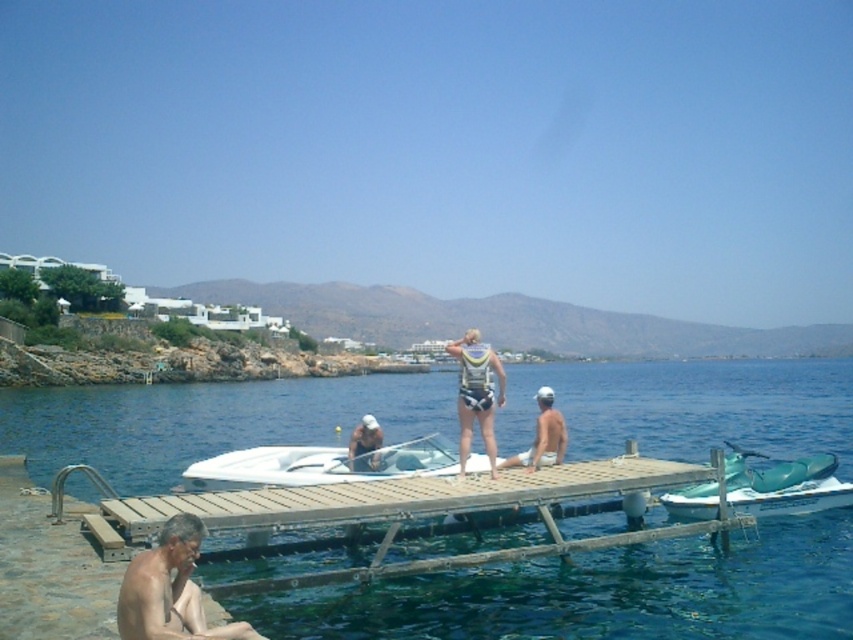
Describe the element at coordinates (318, 465) in the screenshot. Image resolution: width=853 pixels, height=640 pixels. I see `white glossy boat at center` at that location.

Consider the image. Who is positioned more to the left, white glossy boat at center or teal plastic jet ski at lower right?

white glossy boat at center

Between point (408, 440) and point (834, 458), which one is positioned in front?

Point (834, 458) is more forward.

The image size is (853, 640). What are the coordinates of `white glossy boat at center` in the screenshot? It's located at (318, 465).

Is gray hairless skin at lower left to the left of white fabric cap at center from the viewer's perspective?

Indeed, gray hairless skin at lower left is positioned on the left side of white fabric cap at center.

What do you see at coordinates (169, 589) in the screenshot?
I see `gray hairless skin at lower left` at bounding box center [169, 589].

Locate an element on the screen. gray hairless skin at lower left is located at coordinates (169, 589).

Is wooden dock at center to the right of white matte swimwear at center from the viewer's perspective?

In fact, wooden dock at center is to the left of white matte swimwear at center.

Is the position of wooden dock at center more distant than that of white matte swimwear at center?

No, it is in front of white matte swimwear at center.

Who is more distant from viewer, [370,499] or [538,465]?

The point [538,465] is more distant.

At what (x,y) coordinates should I click in order to perform the action: click on wooden dock at center. Please return your answer as a coordinate pair (x, y). The width and height of the screenshot is (853, 640). Looking at the image, I should click on (424, 513).